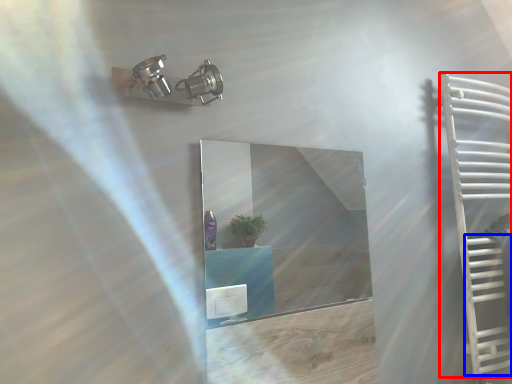
Question: Which point is closer to the camera, ladder (highlighted by a red box) or stairs (highlighted by a blue box)?

Choices:
 (A) ladder
 (B) stairs

Answer: (A)